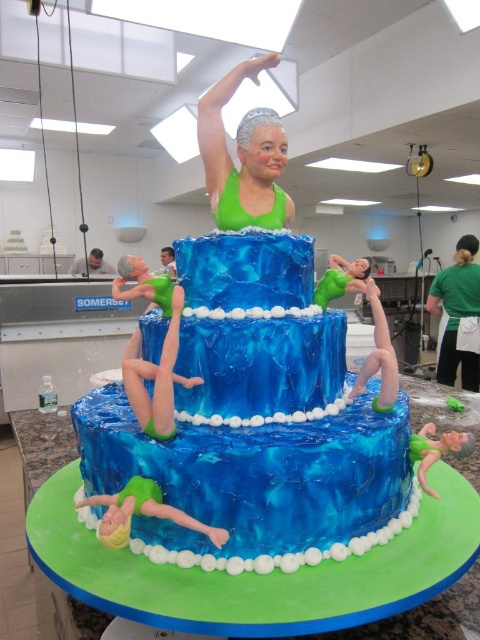
Can you confirm if blue marbled cake at center is positioned below green fabric apron at lower right?

Yes, blue marbled cake at center is below green fabric apron at lower right.

Is the position of blue marbled cake at center more distant than that of green fabric apron at lower right?

No.

Is point (195, 358) behind point (470, 294)?

No, it is in front of (470, 294).

The width and height of the screenshot is (480, 640). What are the coordinates of `blue marbled cake at center` in the screenshot? It's located at (256, 420).